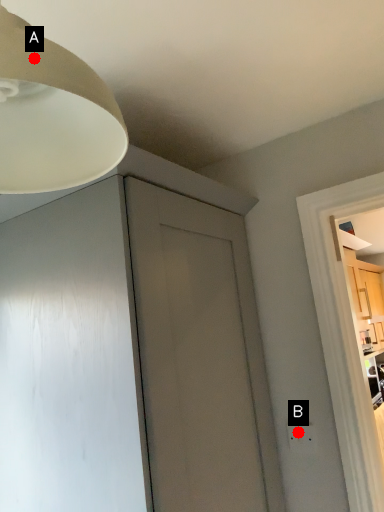
Question: Two points are circled on the image, labeled by A and B beside each circle. Which of the following is the farthest from the observer?

Choices:
 (A) A is further
 (B) B is further

Answer: (B)